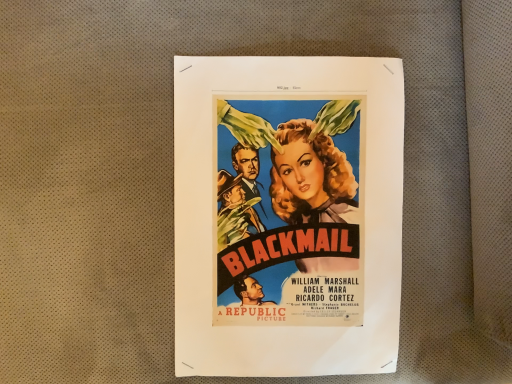
The width and height of the screenshot is (512, 384). Describe the element at coordinates (287, 215) in the screenshot. I see `matte paper poster at center` at that location.

Locate an element on the screen. The width and height of the screenshot is (512, 384). matte paper poster at center is located at coordinates (287, 215).

At what (x,y) coordinates should I click in order to perform the action: click on matte paper poster at center. Please return your answer as a coordinate pair (x, y). The height and width of the screenshot is (384, 512). Looking at the image, I should click on (287, 215).